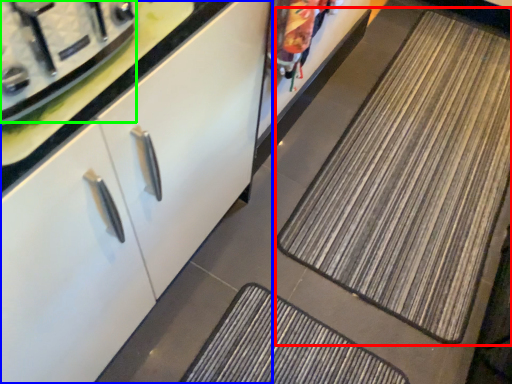
Question: Which object is the farthest from mat (highlighted by a red box)? Choose among these: cabinetry (highlighted by a blue box) or appliance (highlighted by a green box).

Choices:
 (A) cabinetry
 (B) appliance

Answer: (B)